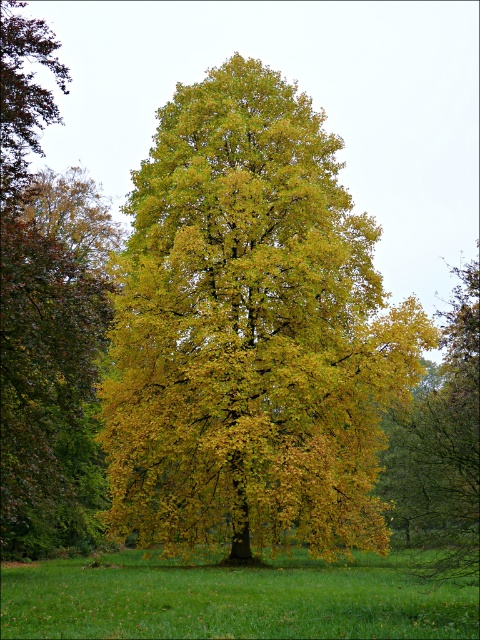
Question: Does yellow-green leafy tree at center appear on the right side of green grassy field at center?

Choices:
 (A) yes
 (B) no

Answer: (A)

Question: Can you confirm if yellow-green leafy tree at center is positioned to the left of green grassy field at center?

Choices:
 (A) no
 (B) yes

Answer: (A)

Question: Which of the following is the farthest from the observer?

Choices:
 (A) (252, 618)
 (B) (82, 221)

Answer: (B)

Question: Which of these objects is positioned farthest from the yellow-green leaves at center?

Choices:
 (A) green grassy field at center
 (B) yellow-green leafy tree at center

Answer: (A)

Question: Among these points, which one is nearest to the camera?

Choices:
 (A) [184, 141]
 (B) [468, 609]

Answer: (B)

Question: Is yellow-green leafy tree at center to the left of green grassy field at center from the viewer's perspective?

Choices:
 (A) yes
 (B) no

Answer: (B)